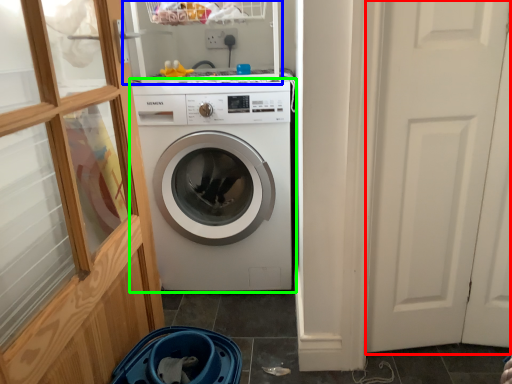
Question: Which object is the farthest from screen door (highlighted by a red box)? Choose among these: shelf (highlighted by a blue box) or washing machine (highlighted by a green box).

Choices:
 (A) shelf
 (B) washing machine

Answer: (A)